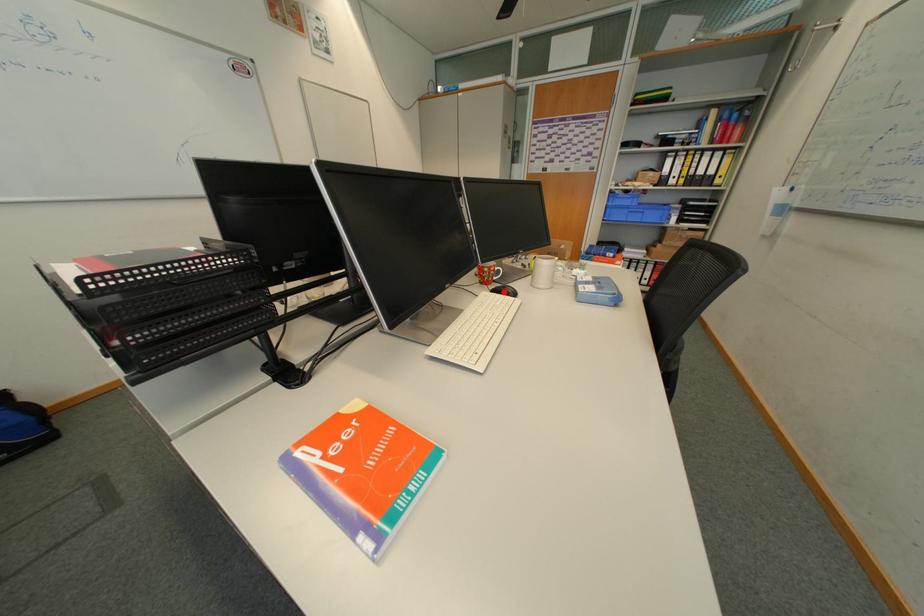
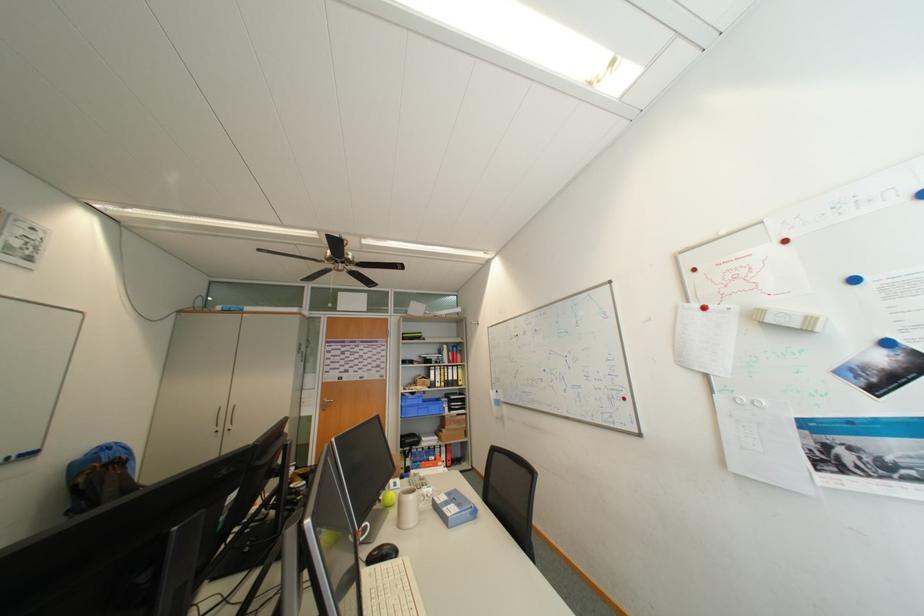
Locate, in the second image, the point that corresponds to the highlighted location in the first image.

(381, 562)